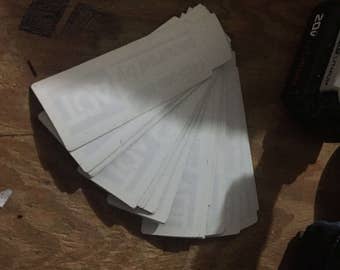
You are a GUI agent. You are given a task and a screenshot of the screen. Output one action in this format:
    pyautogui.click(x=<x>, y=<y>)
    Task: Click on the wood surface
    
    Given the screenshot: What is the action you would take?
    pyautogui.click(x=10, y=13), pyautogui.click(x=25, y=249), pyautogui.click(x=319, y=205), pyautogui.click(x=296, y=18)